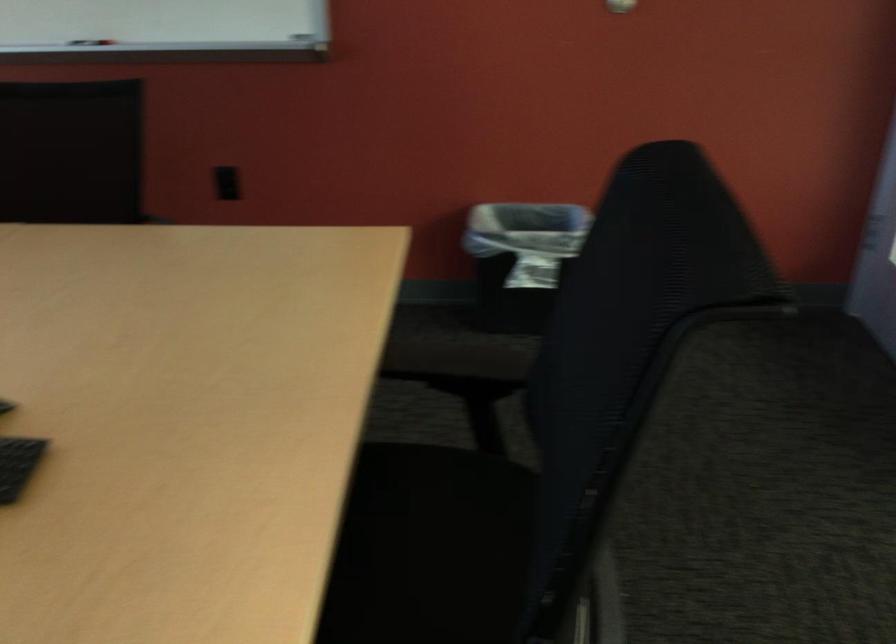
This screenshot has height=644, width=896. What do you see at coordinates (227, 183) in the screenshot?
I see `the black light switch` at bounding box center [227, 183].